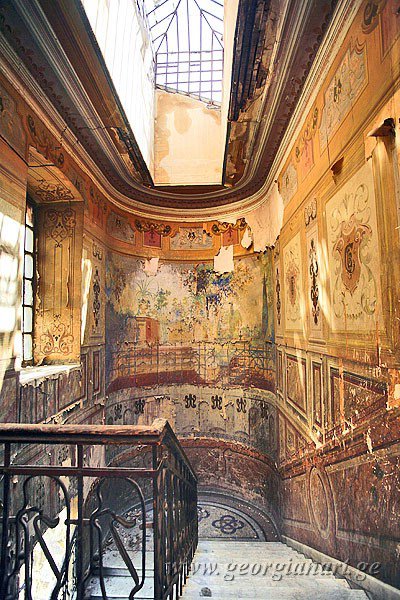
The height and width of the screenshot is (600, 400). What are the coordinates of `skylight` in the screenshot? It's located at (195, 20).